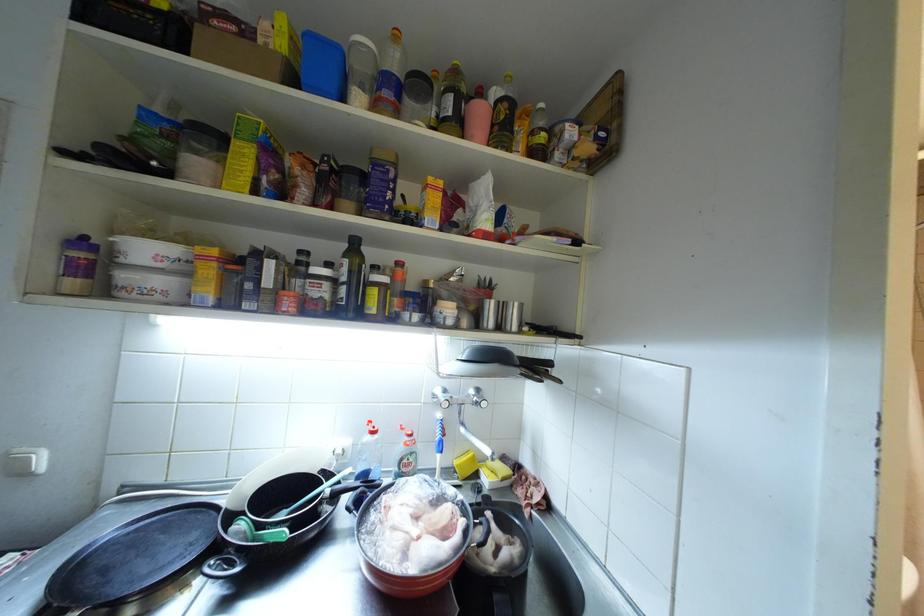
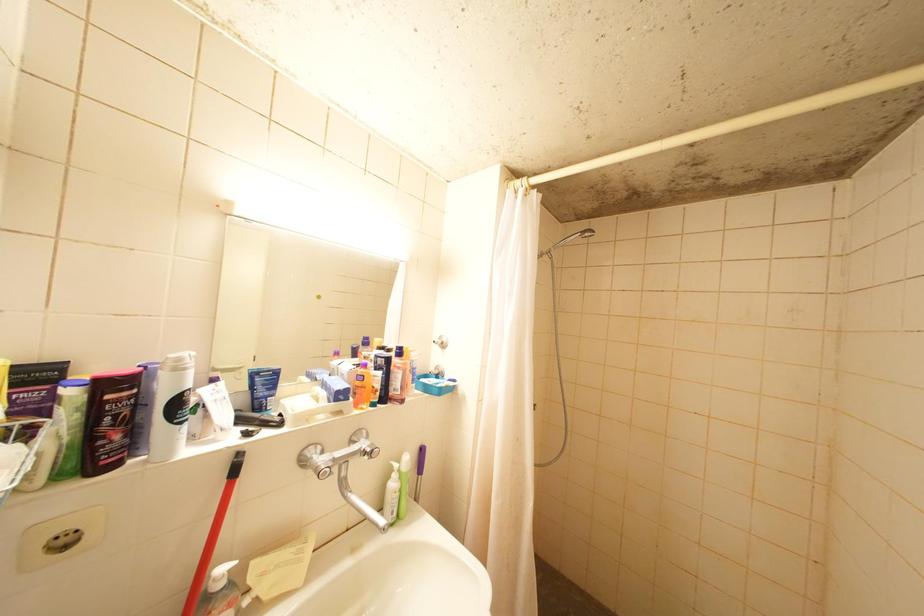
Question: The camera is either moving clockwise (left) or counter-clockwise (right) around the object. The first image is from the beginning of the video and the second image is from the end. Is the camera moving left or right when shooting the video?

Choices:
 (A) Left
 (B) Right

Answer: (A)